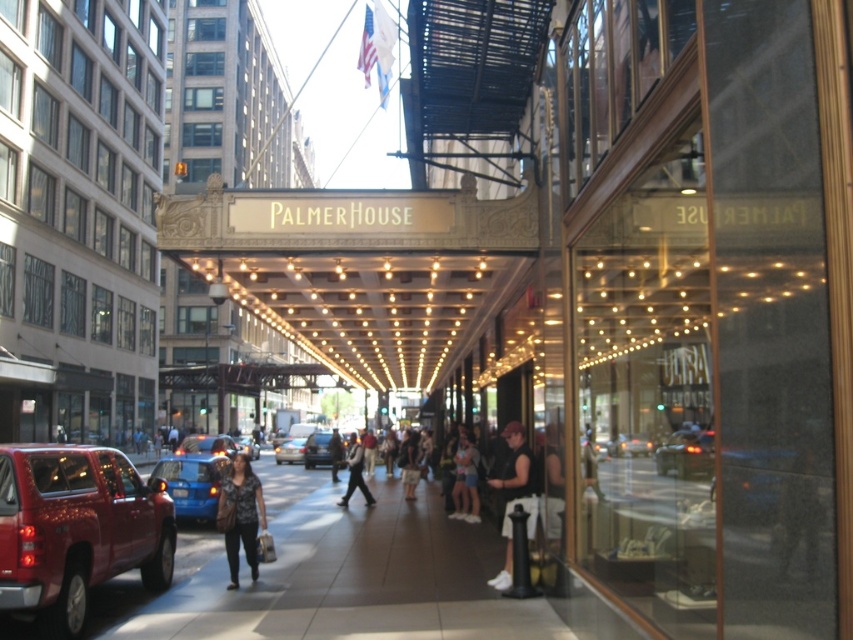
You are a delivery person trying to park your vehicle in the Palmer House entrance area. You have two options to choose from parking spots near the metallic red truck at lower left and the blue glossy car at center. Which parking spot can accommodate a wider vehicle?

The parking spot near the blue glossy car at center can accommodate a wider vehicle because the metallic red truck at lower left is thinner than the blue glossy car at center.

You are standing at the entrance of the Palmer House and want to move from the point labeled as point (53, 596) to the point labeled as point (180, 460). Which direction should you walk relative to the entrance?

You should walk towards the entrance because point (53, 596) is in front of point (180, 460). Since you are at the entrance, moving towards the entrance would take you from the front point to the one behind it.

You are a photographer standing at the entrance of the Palmer House. You want to capture a photo of both the denim shorts at center and the matte black jacket at center in the same frame. Given that your camera has a maximum focus range of 15 feet, will you be able to capture both subjects clearly in the photo?

The distance between the denim shorts at center and the matte black jacket at center is 16.43 feet. Since your camera can only focus up to 15 feet, both subjects are beyond the maximum focus range. Therefore, you wonanot capture both clearly in the same frame.